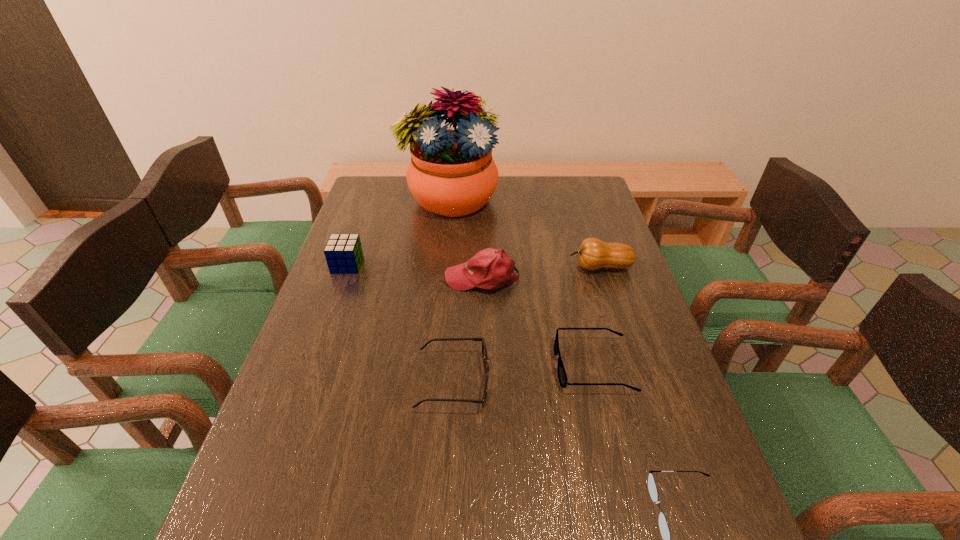
Where is `the farthest object`? The height and width of the screenshot is (540, 960). the farthest object is located at coordinates (452, 173).

The image size is (960, 540). Find the location of `flower arrangement`. flower arrangement is located at coordinates (452, 173).

The height and width of the screenshot is (540, 960). Find the location of `baseball cap`. baseball cap is located at coordinates (490, 269).

You are a GUI agent. You are given a task and a screenshot of the screen. Output one action in this format:
    pyautogui.click(x=<x>, y=<y>)
    Task: Click on the gourd
    
    Given the screenshot: What is the action you would take?
    pyautogui.click(x=593, y=254)

Locate an element on the screen. This screenshot has height=540, width=960. the fourth shortest object is located at coordinates click(343, 252).

Find the location of `the leftmost object`. the leftmost object is located at coordinates (343, 252).

At what (x,y) coordinates should I click in order to perform the action: click on the leftmost spectacles. Please return your answer as a coordinate pair (x, y). Looking at the image, I should click on (484, 349).

At what (x,y) coordinates should I click in order to perform the action: click on vacant space positioned 0.380m on the right of the flower arrangement. Please return your answer as a coordinate pair (x, y). Looking at the image, I should click on (603, 199).

Where is `free point located 0.320m at the front of the baseball cap with the brim`? This screenshot has height=540, width=960. free point located 0.320m at the front of the baseball cap with the brim is located at coordinates (334, 278).

The image size is (960, 540). Find the location of `vacant area situated 0.120m at the front of the baseball cap with the brim`. vacant area situated 0.120m at the front of the baseball cap with the brim is located at coordinates (403, 278).